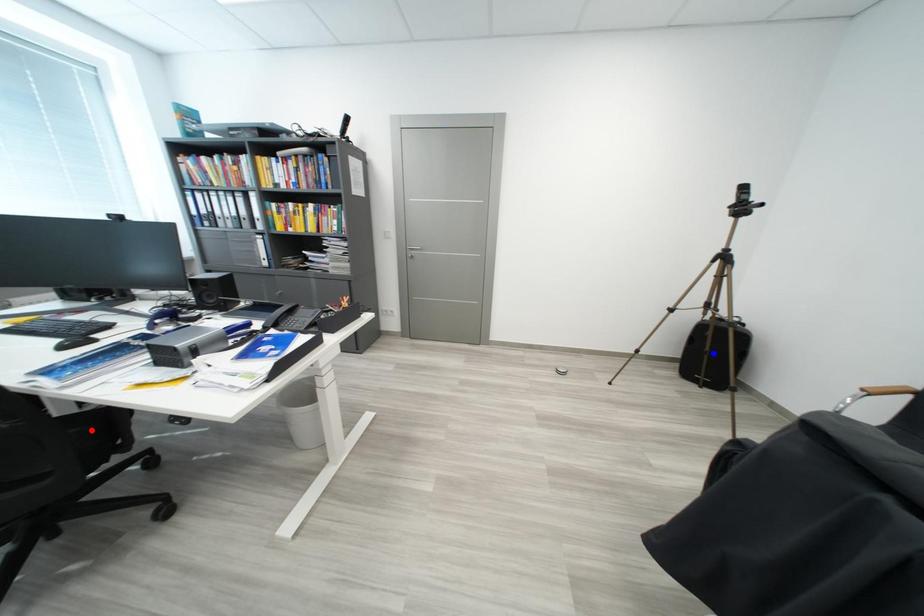
Question: In the image, two points are highlighted. Which point is nearer to the camera? Reply with the corresponding letter.

Choices:
 (A) blue point
 (B) red point

Answer: (B)